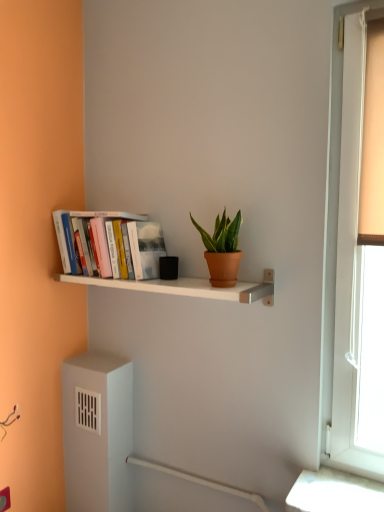
Where is `white matte shelf at center`? This screenshot has height=512, width=384. white matte shelf at center is located at coordinates (182, 287).

Who is bigger, hardcover books at left or white matte shelf at center?

With larger size is hardcover books at left.

From the image's perspective, is hardcover books at left beneath white matte shelf at center?

No, from the image's perspective, hardcover books at left is not below white matte shelf at center.

Is hardcover books at left beside white matte shelf at center?

No, hardcover books at left is not beside white matte shelf at center.

From a real-world perspective, is white matte shelf at center positioned above or below terracotta clay pot at center?

white matte shelf at center is below terracotta clay pot at center.

Where is `shelf below the terracotta clay pot at center (from the image's perspective)`? This screenshot has height=512, width=384. shelf below the terracotta clay pot at center (from the image's perspective) is located at coordinates (182, 287).

Who is bigger, white matte shelf at center or terracotta clay pot at center?

white matte shelf at center.

What's the angular difference between white matte shelf at center and terracotta clay pot at center's facing directions?

The angle between the facing direction of white matte shelf at center and the facing direction of terracotta clay pot at center is 0.136 degrees.

Does terracotta clay pot at center have a greater width compared to white matte shelf at center?

No, terracotta clay pot at center is not wider than white matte shelf at center.

Looking at this image, is terracotta clay pot at center bigger than white matte shelf at center?

Actually, terracotta clay pot at center might be smaller than white matte shelf at center.

Which is farther from the camera, (210, 268) or (108, 280)?

Positioned behind is point (108, 280).

Considering the sizes of objects terracotta clay pot at center and hardcover books at left in the image provided, who is taller, terracotta clay pot at center or hardcover books at left?

hardcover books at left is taller.

From the image's perspective, which object appears higher, terracotta clay pot at center or hardcover books at left?

hardcover books at left is shown above in the image.

Find the location of a particular element. This screenshot has width=384, height=512. houseplant located in front of the hardcover books at left is located at coordinates (222, 250).

From a real-world perspective, which object stands above the other?

hardcover books at left.

Is white matte shelf at center oriented away from hardcover books at left?

That's not correct — white matte shelf at center is not looking away from hardcover books at left.

Considering the sizes of objects white matte shelf at center and hardcover books at left in the image provided, who is shorter, white matte shelf at center or hardcover books at left?

Standing shorter between the two is white matte shelf at center.

Which is more to the left, white matte shelf at center or hardcover books at left?

Positioned to the left is hardcover books at left.

Is hardcover books at left inside white matte shelf at center?

That's incorrect, hardcover books at left is not inside white matte shelf at center.

Which is correct: hardcover books at left is inside terracotta clay pot at center, or outside of it?

hardcover books at left lies outside terracotta clay pot at center.

Is hardcover books at left turned away from terracotta clay pot at center?

hardcover books at left is not turned away from terracotta clay pot at center.

Where is `book positioned vertically above the terracotta clay pot at center (from a real-world perspective)`? Image resolution: width=384 pixels, height=512 pixels. book positioned vertically above the terracotta clay pot at center (from a real-world perspective) is located at coordinates (126, 243).

Which is behind, hardcover books at left or terracotta clay pot at center?

Positioned behind is hardcover books at left.

Identify the location of shelf that appears in front of the hardcover books at left. Image resolution: width=384 pixels, height=512 pixels. (182, 287).

You are a GUI agent. You are given a task and a screenshot of the screen. Output one action in this format:
    pyautogui.click(x=<x>, y=<y>)
    Task: Click on the shelf located below the terracotta clay pot at center (from the image's perspective)
    
    Given the screenshot: What is the action you would take?
    pyautogui.click(x=182, y=287)

Considering their positions, is white matte shelf at center positioned closer to terracotta clay pot at center than hardcover books at left?

white matte shelf at center.

Looking at the image, which one is located closer to hardcover books at left, terracotta clay pot at center or white matte shelf at center?

white matte shelf at center is positioned closer to the anchor hardcover books at left.

Estimate the real-world distances between objects in this image. Which object is closer to terracotta clay pot at center, hardcover books at left or white matte shelf at center?

white matte shelf at center.

Looking at the image, which one is located closer to hardcover books at left, white matte shelf at center or terracotta clay pot at center?

white matte shelf at center lies closer to hardcover books at left than the other object.

When comparing their distances from white matte shelf at center, does terracotta clay pot at center or hardcover books at left seem further?

terracotta clay pot at center is positioned further to the anchor white matte shelf at center.

Based on their spatial positions, is hardcover books at left or terracotta clay pot at center further from white matte shelf at center?

Among the two, terracotta clay pot at center is located further to white matte shelf at center.

At what (x,y) coordinates should I click in order to perform the action: click on shelf between hardcover books at left and terracotta clay pot at center. Please return your answer as a coordinate pair (x, y). This screenshot has width=384, height=512. Looking at the image, I should click on (182, 287).